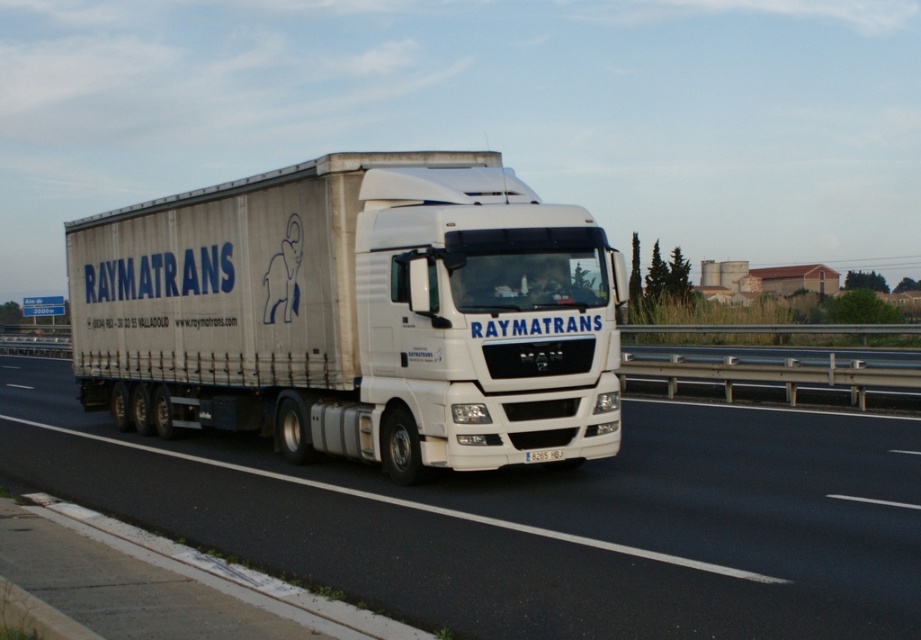
Describe the element at coordinates (535, 520) in the screenshot. The height and width of the screenshot is (640, 921). I see `white glossy truck at center` at that location.

How far apart are white glossy truck at center and white matte truck at center?

white glossy truck at center and white matte truck at center are 6.69 feet apart.

Does point (896, 637) come farther from viewer compared to point (517, 323)?

No, (896, 637) is in front of (517, 323).

You are a GUI agent. You are given a task and a screenshot of the screen. Output one action in this format:
    pyautogui.click(x=<x>, y=<y>)
    Task: Click on the white glossy truck at center
    Image resolution: width=921 pixels, height=640 pixels.
    Given the screenshot: What is the action you would take?
    pyautogui.click(x=535, y=520)